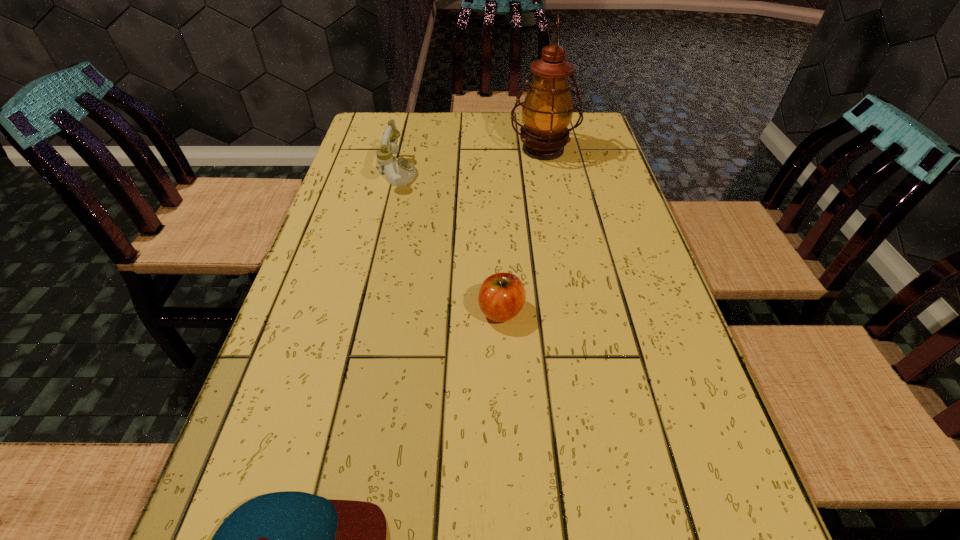
Locate an element on the screen. The width and height of the screenshot is (960, 540). object that is positioned at the far right corner is located at coordinates (547, 110).

At what (x,y) coordinates should I click in order to perform the action: click on free point at the far edge. Please return your answer as a coordinate pair (x, y). The image size is (960, 540). Looking at the image, I should click on (507, 117).

The height and width of the screenshot is (540, 960). In order to click on blank space at the left edge of the desktop in this screenshot , I will do `click(326, 328)`.

Identify the location of vacant space at the right edge. (569, 194).

Find the location of a particular element. This screenshot has height=540, width=960. unoccupied area between the oil lamp and the apple is located at coordinates (522, 230).

What are the coordinates of `free spot between the apple and the tallest object` in the screenshot? It's located at (522, 230).

In order to click on free area in between the third tallest object and the tallest object in this screenshot , I will do coord(522,230).

This screenshot has height=540, width=960. I want to click on vacant area that lies between the tallest object and the second shortest object, so click(522, 230).

This screenshot has height=540, width=960. What are the coordinates of `free spot between the oil lamp and the telephone` in the screenshot? It's located at (470, 161).

Where is `blank region between the telephone and the tallest object`? blank region between the telephone and the tallest object is located at coordinates (470, 161).